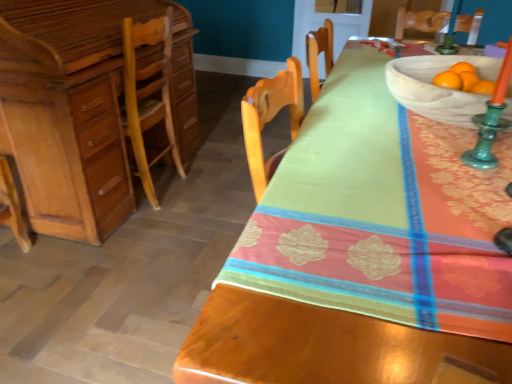
Question: In terms of height, does light brown wood desk at left look taller or shorter compared to natural wood bowl at upper right?

Choices:
 (A) short
 (B) tall

Answer: (B)

Question: Would you say light brown wood desk at left is inside or outside natural wood bowl at upper right?

Choices:
 (A) outside
 (B) inside

Answer: (A)

Question: Which is farther from the matte wood desk at left?

Choices:
 (A) light brown wood desk at left
 (B) natural wood bowl at upper right

Answer: (A)

Question: Which object is the farthest from the light brown wood desk at left?

Choices:
 (A) matte wood desk at left
 (B) natural wood bowl at upper right

Answer: (B)